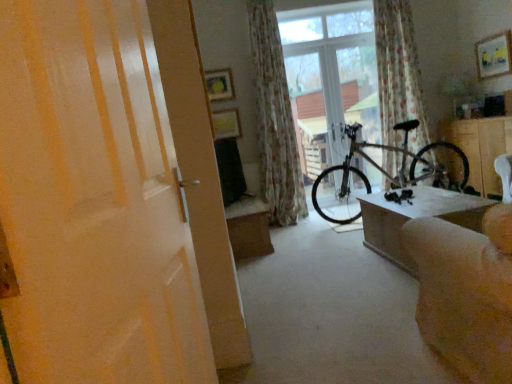
Question: Is beige fabric couch at lower right directly adjacent to matte white door at center?

Choices:
 (A) no
 (B) yes

Answer: (A)

Question: Is beige fabric couch at lower right surrounding matte white door at center?

Choices:
 (A) no
 (B) yes

Answer: (A)

Question: From a real-world perspective, is beige fabric couch at lower right positioned over matte white door at center based on gravity?

Choices:
 (A) no
 (B) yes

Answer: (A)

Question: Is beige fabric couch at lower right closer to camera compared to matte white door at center?

Choices:
 (A) no
 (B) yes

Answer: (A)

Question: Is beige fabric couch at lower right outside of matte white door at center?

Choices:
 (A) no
 (B) yes

Answer: (B)

Question: Considering the relative sizes of beige fabric couch at lower right and matte white door at center in the image provided, is beige fabric couch at lower right smaller than matte white door at center?

Choices:
 (A) no
 (B) yes

Answer: (A)

Question: Is wooden coffee table at lower right, the 1th table positioned from the right, a part of wooden table at center, the second table positioned from the right?

Choices:
 (A) no
 (B) yes

Answer: (A)

Question: Is wooden table at center, marked as the first table in a back-to-front arrangement, completely or partially outside of wooden coffee table at lower right, the 1th table positioned from the right?

Choices:
 (A) yes
 (B) no

Answer: (A)

Question: Could you tell me if wooden table at center, marked as the first table in a back-to-front arrangement, is turned towards wooden coffee table at lower right, acting as the 1th table starting from the front?

Choices:
 (A) yes
 (B) no

Answer: (B)

Question: From a real-world perspective, is wooden table at center, the second table positioned from the right, on wooden coffee table at lower right, acting as the 1th table starting from the front?

Choices:
 (A) no
 (B) yes

Answer: (B)

Question: Is wooden table at center, marked as the first table in a back-to-front arrangement, touching wooden coffee table at lower right, the 1th table positioned from the right?

Choices:
 (A) no
 (B) yes

Answer: (A)

Question: Does wooden table at center, marked as the first table in a back-to-front arrangement, appear on the left side of wooden coffee table at lower right, which ranks as the 2th table in left-to-right order?

Choices:
 (A) yes
 (B) no

Answer: (A)

Question: Is matte yellow picture frame at upper center, which appears as the second picture frame when viewed from the right, turned away from wooden table at center, the second table positioned from the right?

Choices:
 (A) no
 (B) yes

Answer: (A)